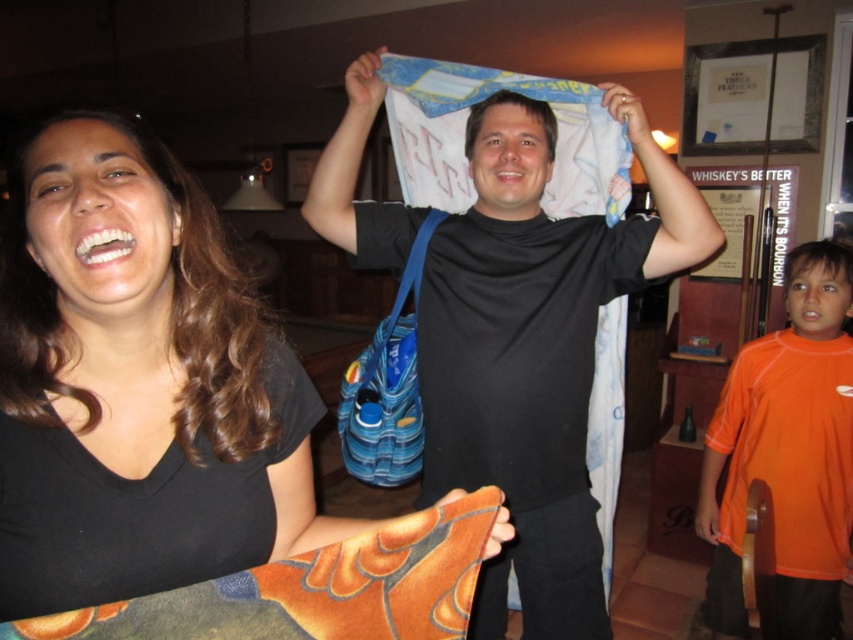
In the scene shown: What is the color of the shirt worn by the person at the point marked as (137, 384)?

The point marked at (137, 384) corresponds to the matte black shirt at left, so the color is black.

You are a photographer in this room. You need to capture a photo that includes both the white fabric at center and the orange jersey at right. Which object should you position higher in the frame to ensure both are visible?

The white fabric at center should be positioned higher in the frame since it is above the orange jersey at right.